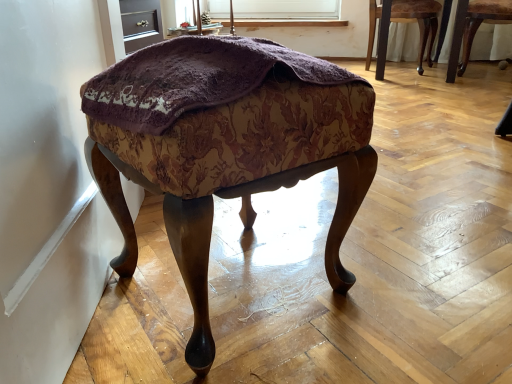
Find the location of a particular element. This screenshot has width=512, height=384. vacant area that lies to the right of velvet-like fabric stool at center is located at coordinates (407, 308).